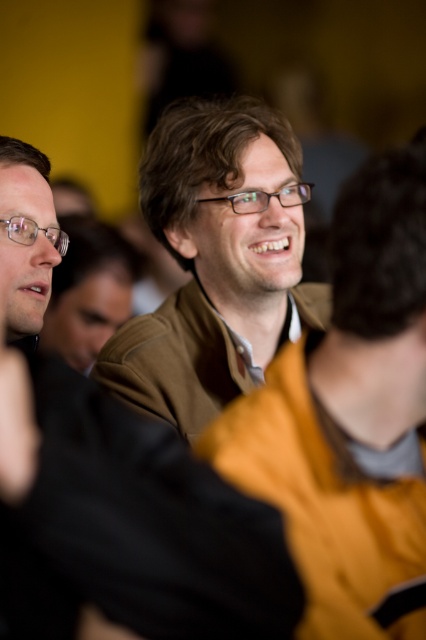
Is brown matte jacket at center to the left of brown leather jacket at center from the viewer's perspective?

Yes, brown matte jacket at center is to the left of brown leather jacket at center.

Describe the element at coordinates (112, 483) in the screenshot. I see `brown matte jacket at center` at that location.

Is point (28, 340) positioned before point (393, 493)?

No, it is behind (393, 493).

You are a GUI agent. You are given a task and a screenshot of the screen. Output one action in this format:
    pyautogui.click(x=<x>, y=<y>)
    Task: Click on the brown matte jacket at center
    This screenshot has height=640, width=426.
    Given the screenshot: What is the action you would take?
    click(112, 483)

Consider the image. Does brown matte jacket at center have a greater height compared to matte brown jacket at center?

In fact, brown matte jacket at center may be shorter than matte brown jacket at center.

Is brown matte jacket at center thinner than matte brown jacket at center?

Yes, brown matte jacket at center is thinner than matte brown jacket at center.

Is point (43, 433) closer to camera compared to point (316, 316)?

Yes.

This screenshot has height=640, width=426. In order to click on brown matte jacket at center in this screenshot , I will do `click(112, 483)`.

Does brown leather jacket at center appear under matte brown jacket at center?

Yes, brown leather jacket at center is below matte brown jacket at center.

Does brown leather jacket at center have a greater height compared to matte brown jacket at center?

In fact, brown leather jacket at center may be shorter than matte brown jacket at center.

Which is in front, point (296, 356) or point (181, 131)?

Point (296, 356) is in front.

Image resolution: width=426 pixels, height=640 pixels. Find the location of `brown leather jacket at center`. brown leather jacket at center is located at coordinates (350, 416).